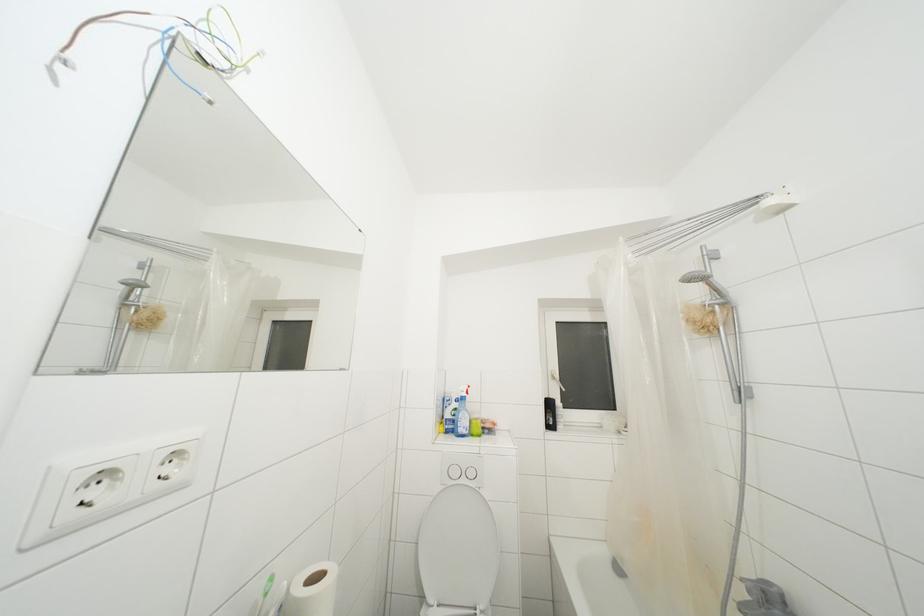
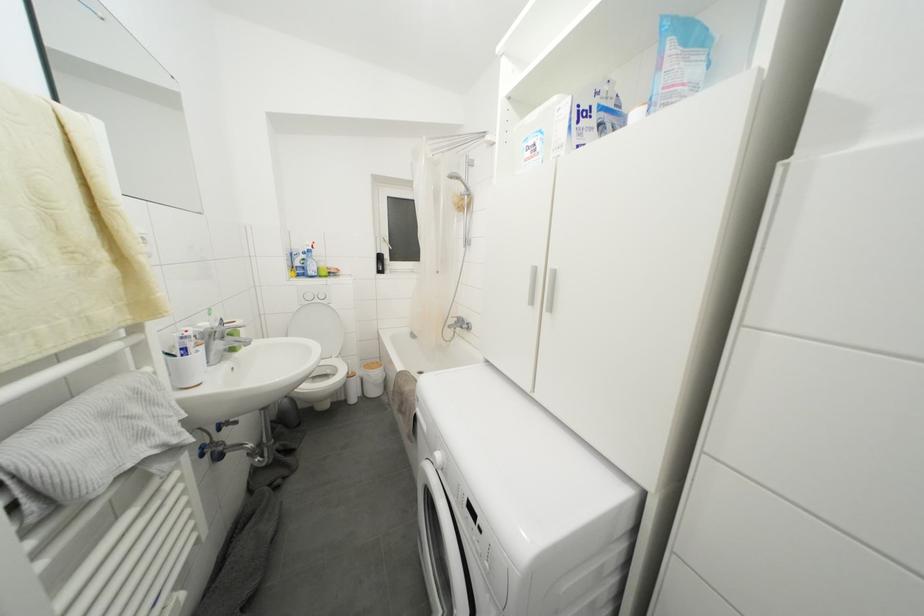
The point at (459,414) is marked in the first image. Where is the corresponding point in the second image?

(308, 264)